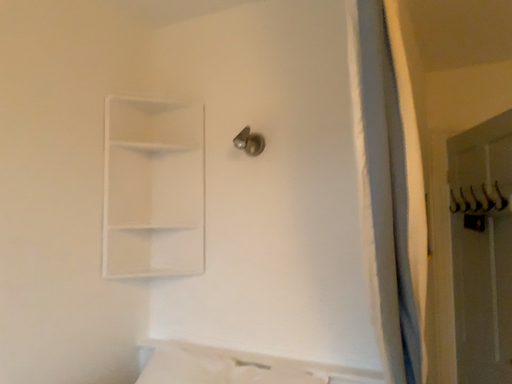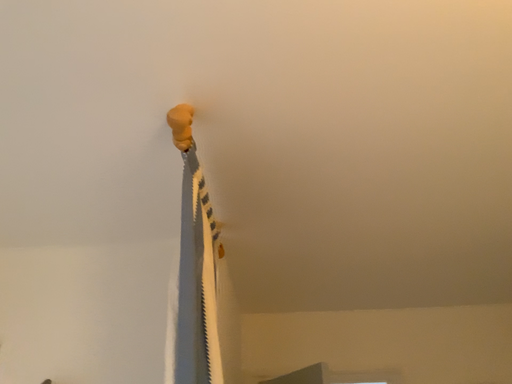
Question: Which way did the camera rotate in the video?

Choices:
 (A) rotated downward
 (B) rotated upward

Answer: (B)